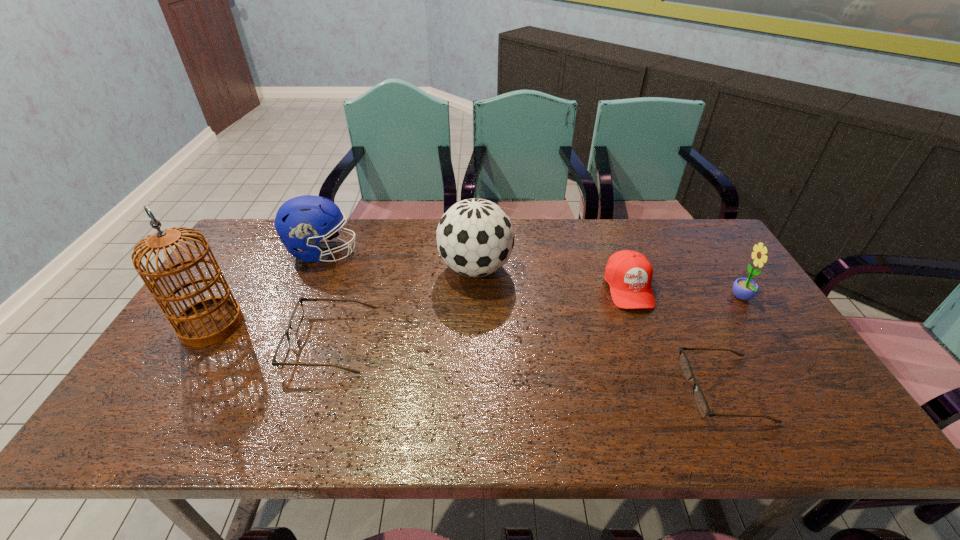
Identify the location of vacant space at the near edge of the desktop. (512, 377).

You are a GUI agent. You are given a task and a screenshot of the screen. Output one action in this format:
    pyautogui.click(x=<x>, y=<y>)
    Task: Click on the free space at the left edge of the desktop
    The height and width of the screenshot is (540, 960).
    Given the screenshot: What is the action you would take?
    pyautogui.click(x=174, y=360)

In the image, there is a desktop. In order to click on vacant space at the far left corner in this screenshot , I will do `click(270, 237)`.

This screenshot has height=540, width=960. Identify the location of free spot at the near left corner of the desktop. (174, 373).

Locate an element on the screen. Image resolution: width=960 pixels, height=540 pixels. vacant area at the far right corner is located at coordinates (718, 237).

Where is `free space between the birdcage and the taller spectacles`? free space between the birdcage and the taller spectacles is located at coordinates (271, 333).

Identify the location of free space that is in between the second shortest object and the football helmet. Image resolution: width=960 pixels, height=540 pixels. (326, 296).

Find the location of a particular element. The width and height of the screenshot is (960, 540). unoccupied area between the rightmost object and the shortest object is located at coordinates (733, 343).

You are a GUI agent. You are given a task and a screenshot of the screen. Output one action in this format:
    pyautogui.click(x=<x>, y=<y>)
    Task: Click on the free space between the sixth tallest object and the football helmet
    The image size is (960, 540).
    Given the screenshot: What is the action you would take?
    pyautogui.click(x=326, y=296)

Find the location of a particular element. The image size is (960, 540). free space that is in between the baseball cap and the left spectacles is located at coordinates click(x=480, y=314).